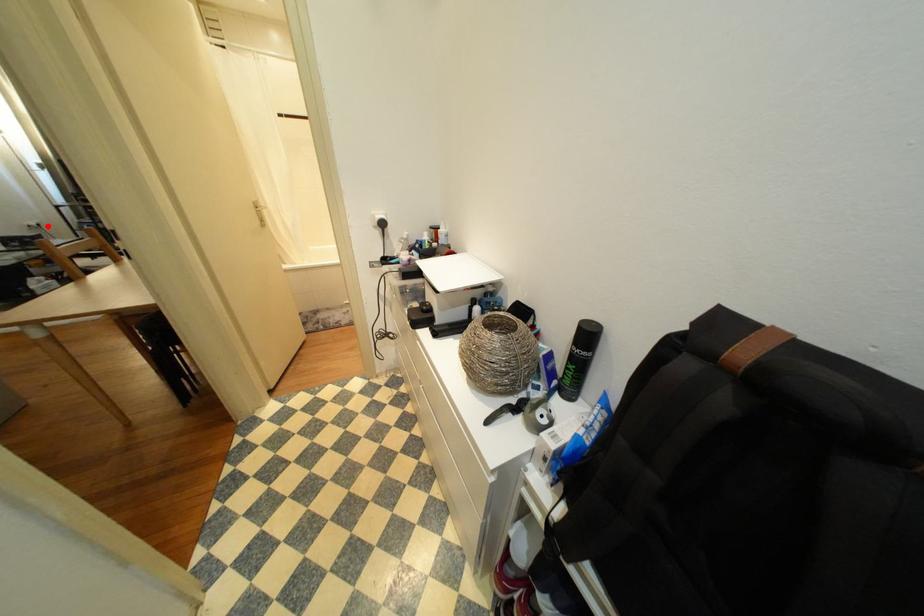
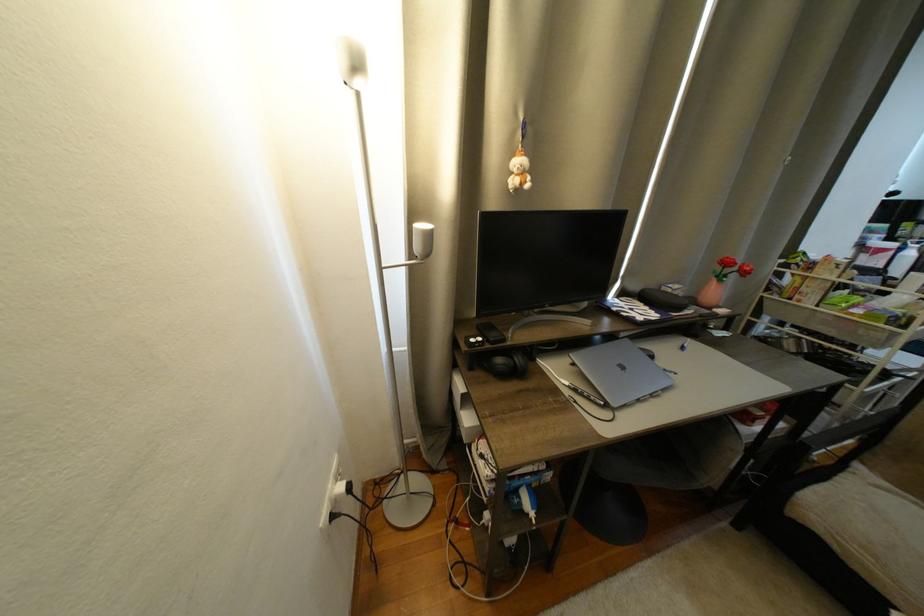
Question: A red point is marked in image1. In image2, is the corresponding 3D point closer to the camera or farther? Reply with the corresponding letter.

Choices:
 (A) The corresponding 3D point is closer.
 (B) The corresponding 3D point is farther.

Answer: (A)